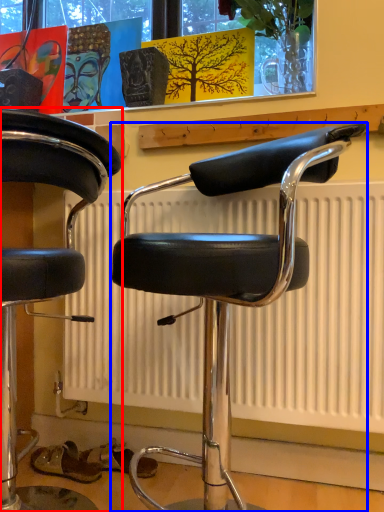
Question: Among these objects, which one is nearest to the camera, chair (highlighted by a red box) or chair (highlighted by a blue box)?

Choices:
 (A) chair
 (B) chair

Answer: (A)